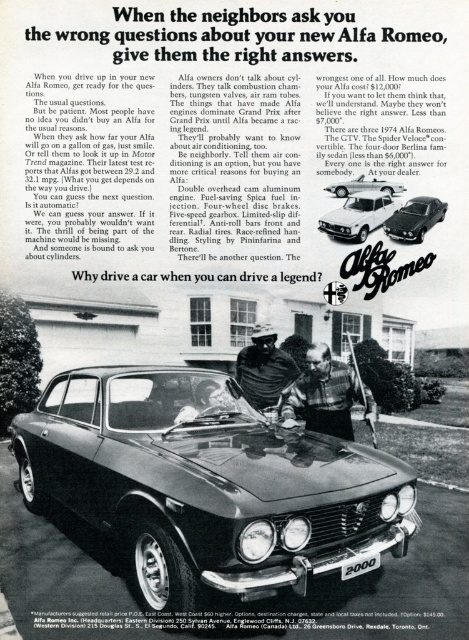
Question: Does metallic silver sedan at center have a lesser width compared to shiny silver sedan at center?

Choices:
 (A) yes
 (B) no

Answer: (B)

Question: Does metallic silver sedan at center have a lesser width compared to shiny black sedan at center?

Choices:
 (A) no
 (B) yes

Answer: (A)

Question: Is metallic silver sedan at center smaller than leather jacket at center?

Choices:
 (A) no
 (B) yes

Answer: (A)

Question: Estimate the real-world distances between objects in this image. Which object is farther from the metallic silver sedan at center?

Choices:
 (A) shiny black sedan at center
 (B) shiny silver sedan at center
 (C) leather jacket at center

Answer: (B)

Question: Which object is closer to the camera taking this photo?

Choices:
 (A) metallic silver sedan at center
 (B) dark blue leather jacket at center
 (C) leather jacket at center
 (D) white glossy sedan at center

Answer: (A)

Question: Which point is closer to the camera taking this photo?

Choices:
 (A) (107, 404)
 (B) (320, 371)

Answer: (A)